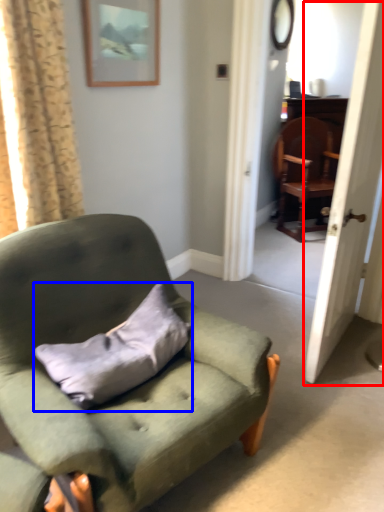
Question: Which object appears farthest to the camera in this image, screen door (highlighted by a red box) or pillow (highlighted by a blue box)?

Choices:
 (A) screen door
 (B) pillow

Answer: (A)